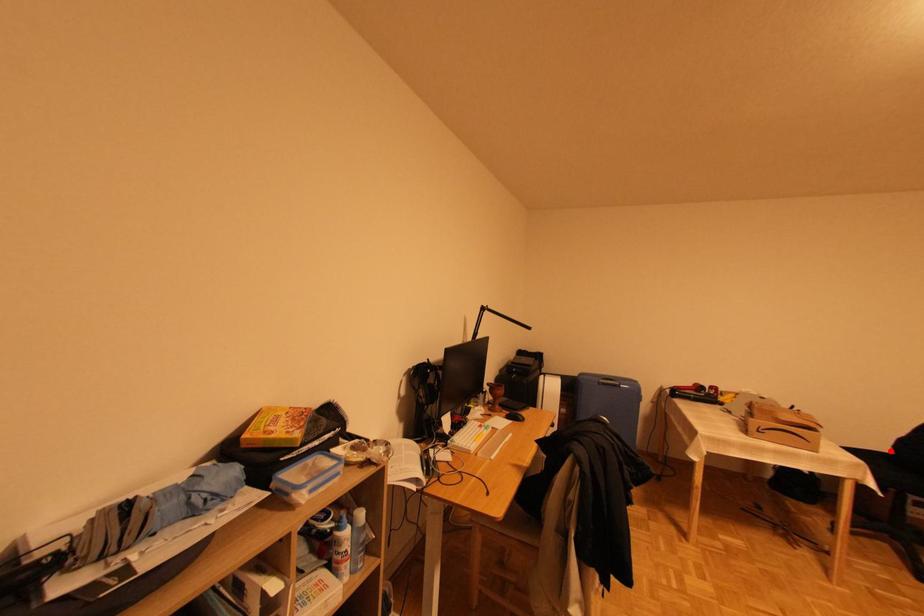
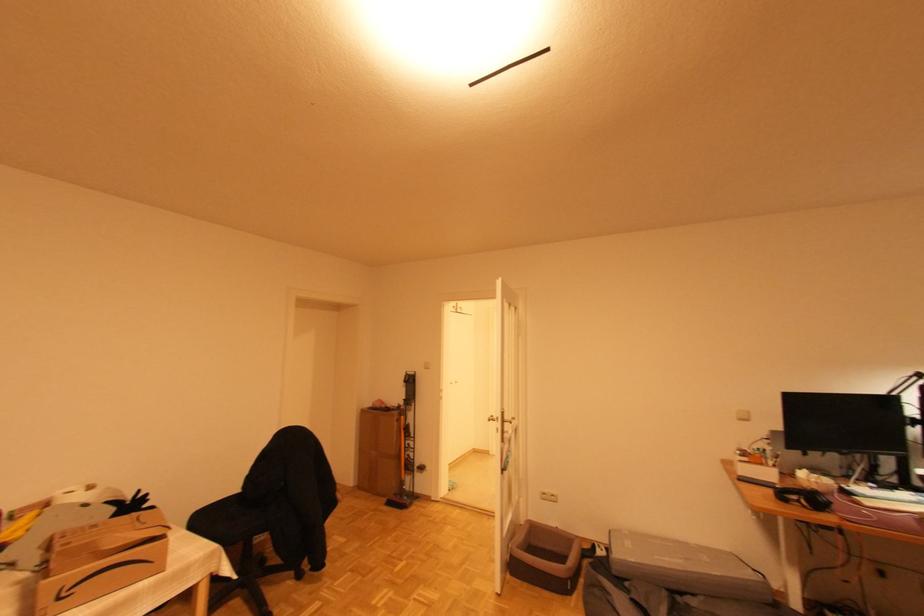
Question: I am providing you with two images of the same scene from different viewpoints. Given a red point in image1, look at the same physical point in image2. Is it:

Choices:
 (A) Closer to the viewpoint
 (B) Farther from the viewpoint

Answer: (B)